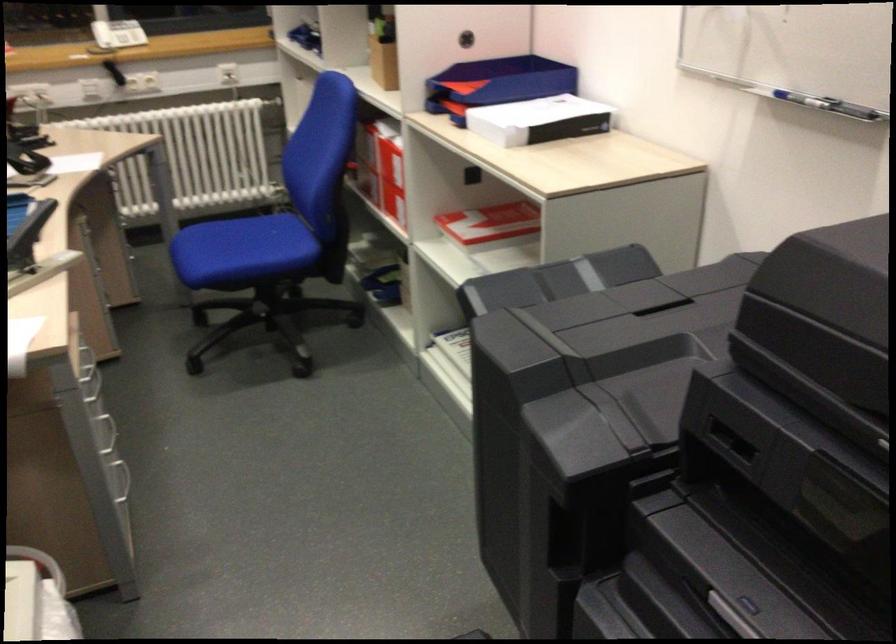
The location [380,167] corresponds to which object?

It corresponds to the red binder in the image.